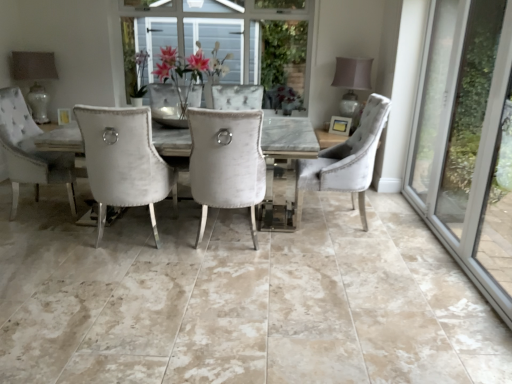
Where is `empty space that is in between transparent glass door at right and velvet white chair at center, which ranks as the first chair in left-to-right order`? empty space that is in between transparent glass door at right and velvet white chair at center, which ranks as the first chair in left-to-right order is located at coordinates (356, 254).